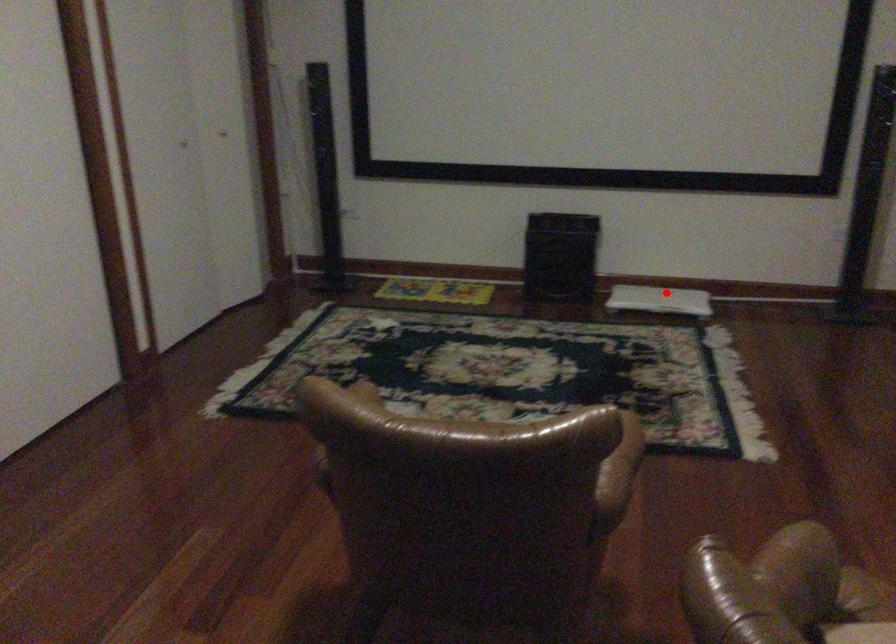
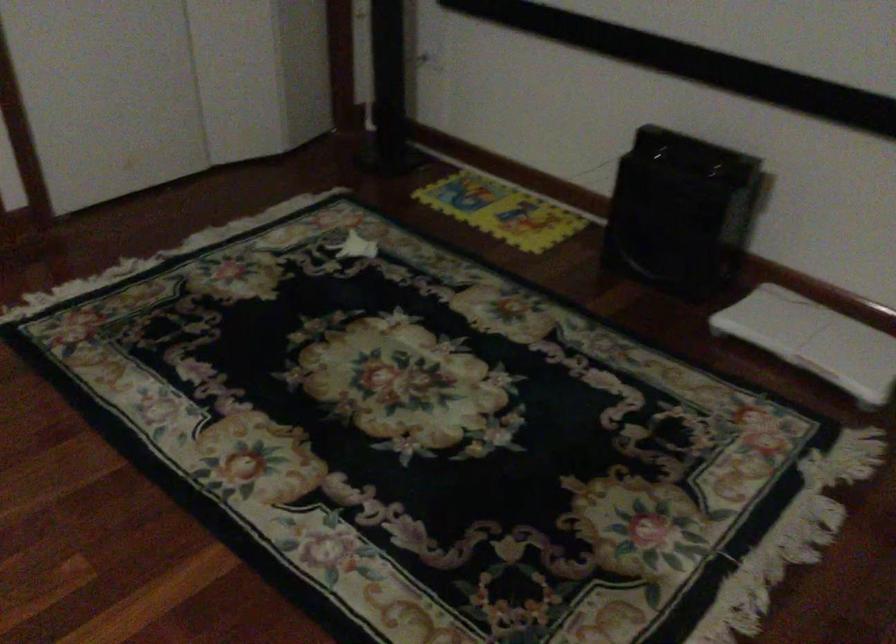
Question: I am providing you with two images of the same scene from different viewpoints. Given a red point in image1, look at the same physical point in image2. Is it:

Choices:
 (A) Closer to the viewpoint
 (B) Farther from the viewpoint

Answer: (A)